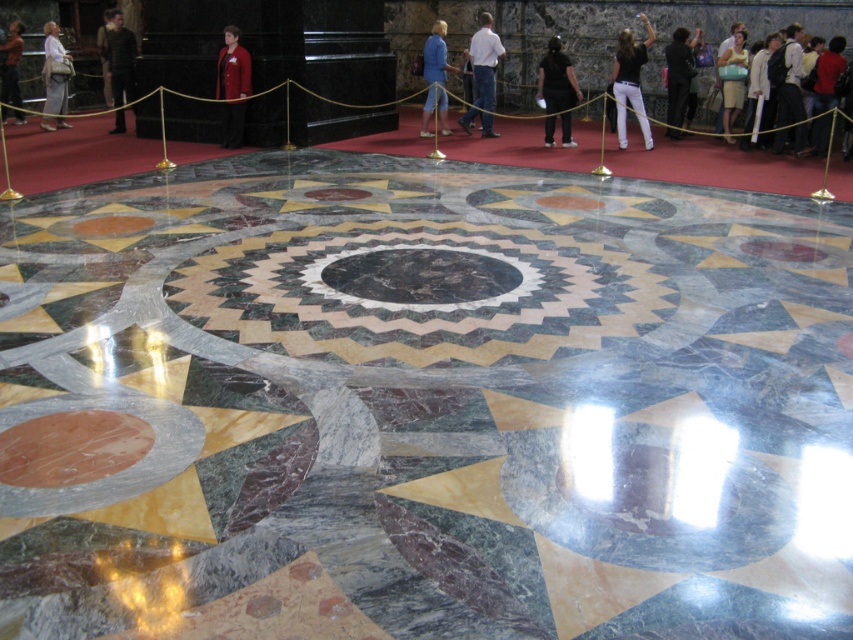
Is point (432, 44) in front of point (726, 138)?

Yes, it is in front of point (726, 138).

Between point (442, 40) and point (740, 92), which one is positioned behind?

Positioned behind is point (740, 92).

At what (x,y) coordinates should I click in order to perform the action: click on blue velvet coat at center. Please return your answer as a coordinate pair (x, y). This screenshot has height=640, width=853. Looking at the image, I should click on (434, 77).

In the scene shown: Can you confirm if dark gray suit at upper left is shorter than dark blue suit at center?

Incorrect, dark gray suit at upper left's height does not fall short of dark blue suit at center's.

Does dark gray suit at upper left have a smaller size compared to dark blue suit at center?

No, dark gray suit at upper left is not smaller than dark blue suit at center.

Is point (107, 45) positioned in front of point (677, 92)?

No, it is behind (677, 92).

Identify the location of dark gray suit at upper left. (120, 65).

Image resolution: width=853 pixels, height=640 pixels. In order to click on dark gray suit at upper left in this screenshot , I will do `click(120, 65)`.

Is point (128, 93) less distant than point (776, 134)?

No, it is behind (776, 134).

In order to click on dark gray suit at upper left in this screenshot , I will do `click(120, 65)`.